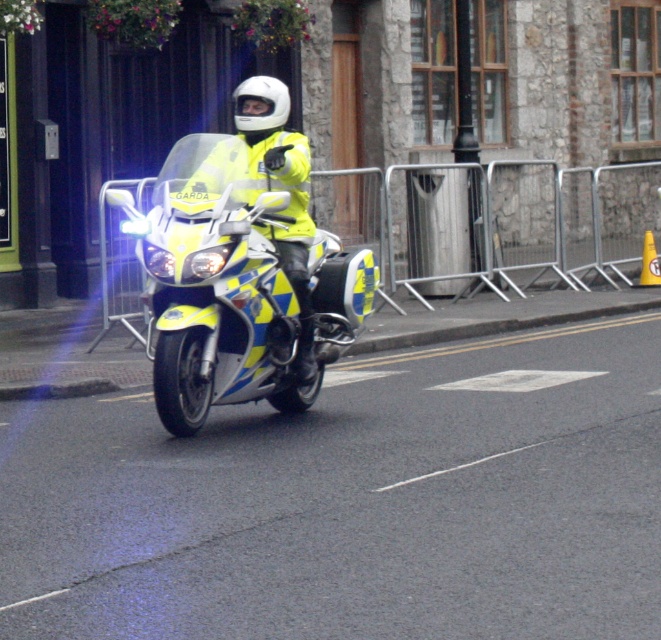
Describe the element at coordinates (233, 285) in the screenshot. This screenshot has width=661, height=640. I see `yellow reflective motorcycle at center` at that location.

Does yellow reflective motorcycle at center appear over yellow matte jacket at center?

No.

Where is `yellow reflective motorcycle at center`? The width and height of the screenshot is (661, 640). yellow reflective motorcycle at center is located at coordinates [233, 285].